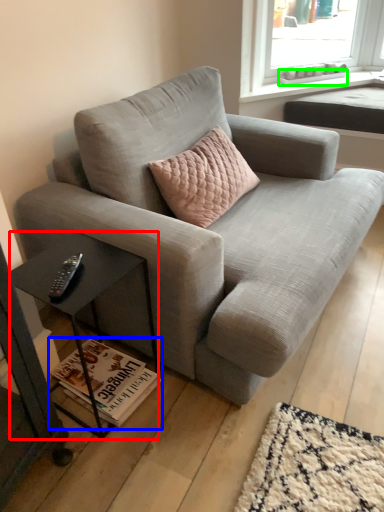
Question: Which is farther away from table (highlighted by a red box)? magazine (highlighted by a blue box) or window sill (highlighted by a green box)?

Choices:
 (A) magazine
 (B) window sill

Answer: (B)